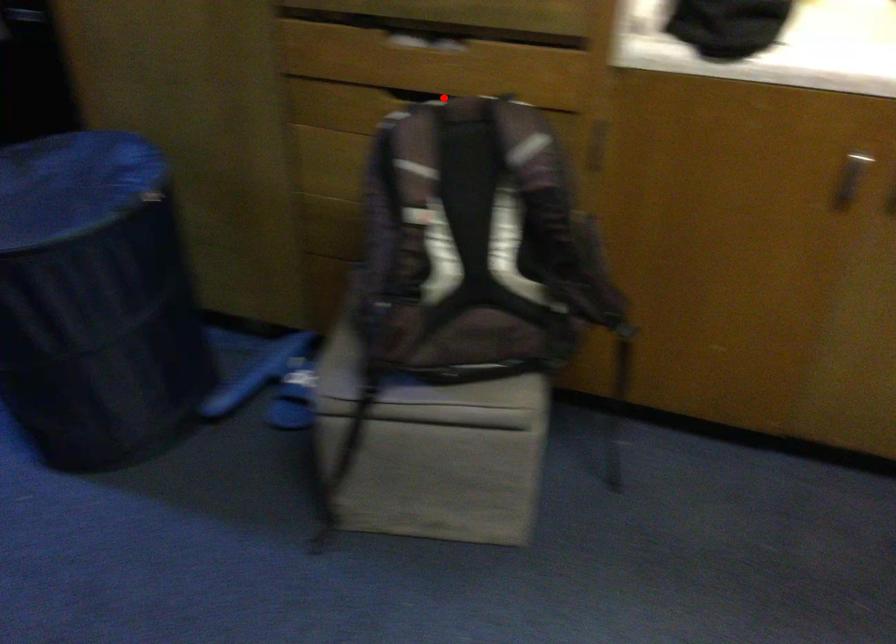
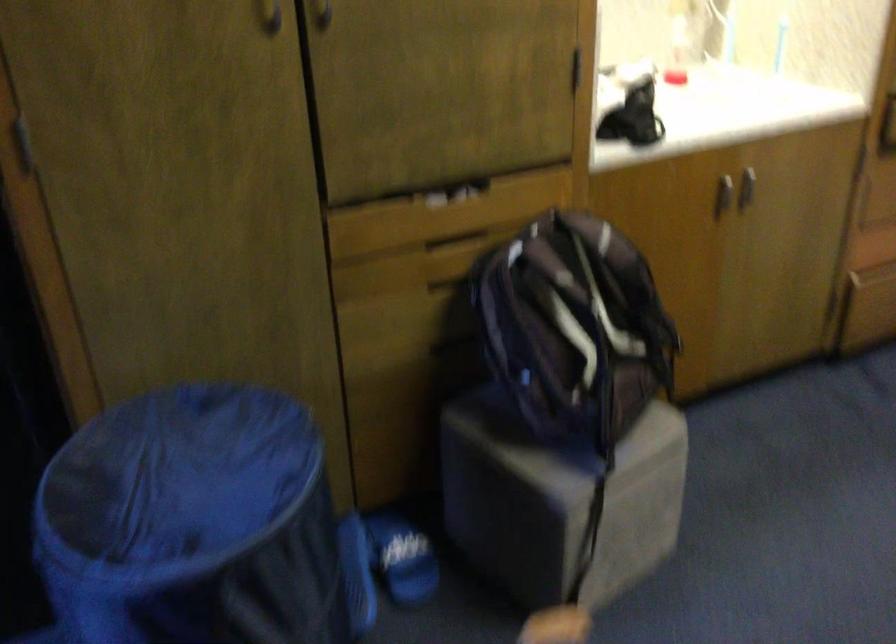
Question: A red point is marked in image1. In image2, is the corresponding 3D point closer to the camera or farther? Reply with the corresponding letter.

Choices:
 (A) The corresponding 3D point is closer.
 (B) The corresponding 3D point is farther.

Answer: (B)